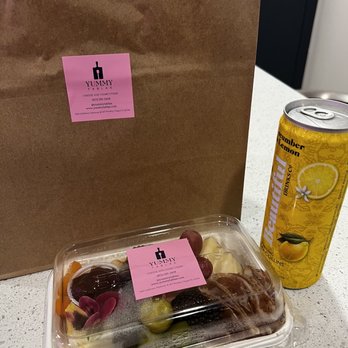
The image size is (348, 348). In order to click on wall in this screenshot , I will do `click(332, 48)`.